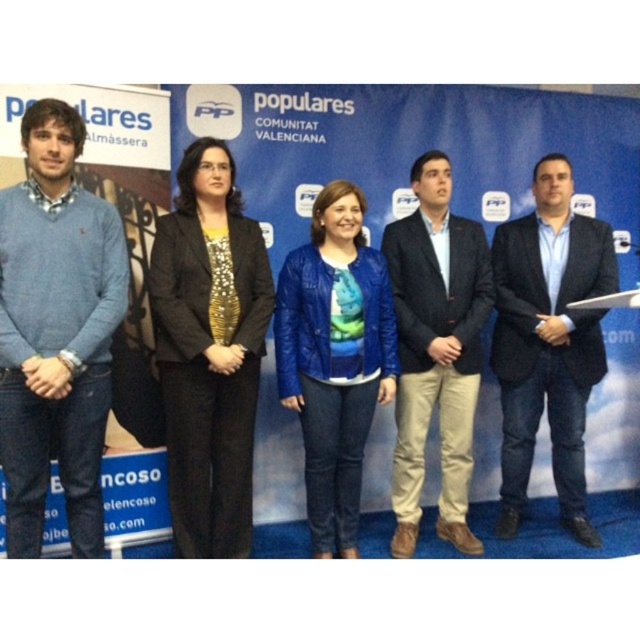
You are a photographer at the event. You need to adjust your camera to capture both the matte blue sweater at left and the blue denim jeans at center in focus. The camera can only focus on objects within a 5 feet range. Is this possible?

The matte blue sweater at left is 6.75 feet away from the blue denim jeans at center. Since the distance between them exceeds the 5 feet focus range, the camera cannot keep both in focus simultaneously.

You are standing 1.5 meters away from the backdrop. Can you see the point at (4, 220) on the backdrop without moving your head?

The point at (4, 220) is 2.38 meters from the viewer. Since you are standing 1.5 meters away from the backdrop, the point is within your viewing distance and you can see it without moving your head.

You are a photographer at the event and need to adjust the lighting so that both the matte blue sweater at left and the dark brown leather jacket at center are equally visible. Considering their sizes, which one might require more focused lighting to ensure visibility?

The matte blue sweater at left has a smaller size compared to the dark brown leather jacket at center, so it might require more focused lighting to ensure visibility.